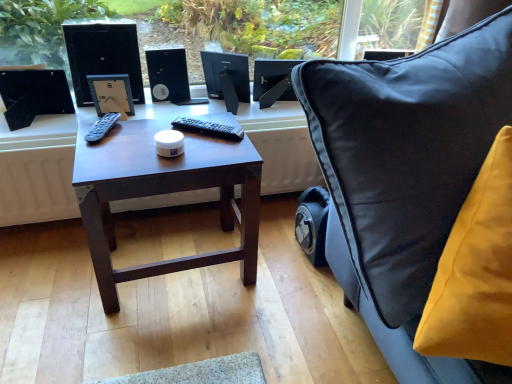
Question: Relative to black plastic speaker at center, is black glossy desktop computer at upper left in front or behind?

Choices:
 (A) front
 (B) behind

Answer: (A)

Question: In the image, is black glossy desktop computer at upper left on the left side or the right side of black plastic speaker at center?

Choices:
 (A) right
 (B) left

Answer: (B)

Question: Estimate the real-world distances between objects in this image. Which object is farther from the velvet yellow cushion at right?

Choices:
 (A) black matte computer monitor at center, placed as the second computer monitor when sorted from right to left
 (B) black plastic speaker at center
 (C) satin black monitor at upper center, acting as the 1th computer monitor starting from the right
 (D) dark wood table at center
 (E) black glossy desktop computer at upper left

Answer: (B)

Question: Which object is the farthest from the dark wood table at center?

Choices:
 (A) satin black monitor at upper center, acting as the 1th computer monitor starting from the right
 (B) black matte computer monitor at center, the first computer monitor viewed from the left
 (C) velvet yellow cushion at right
 (D) black plastic speaker at center
 (E) black glossy desktop computer at upper left

Answer: (D)